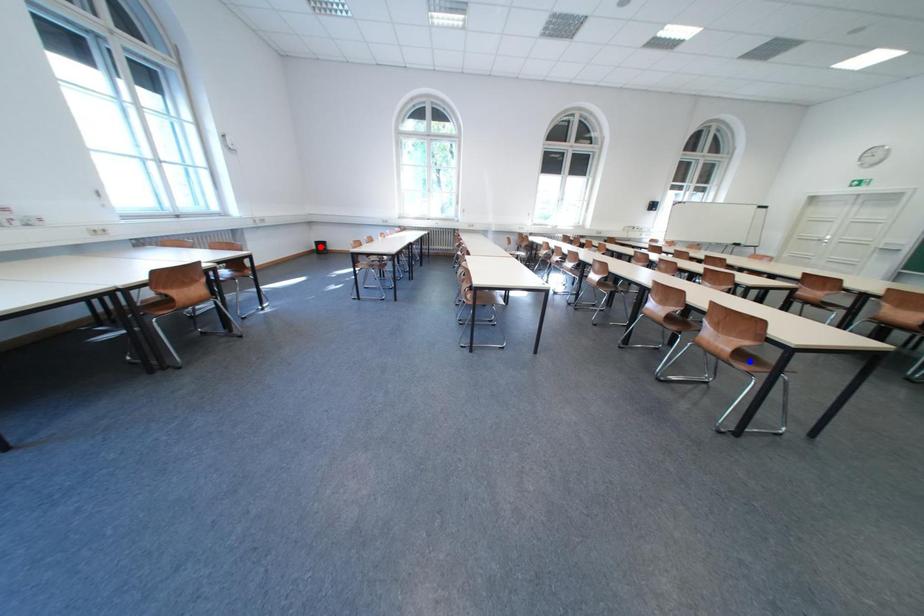
Question: Two points are marked on the image. Which point is closer to the camera?

Choices:
 (A) Blue point is closer.
 (B) Red point is closer.

Answer: (A)